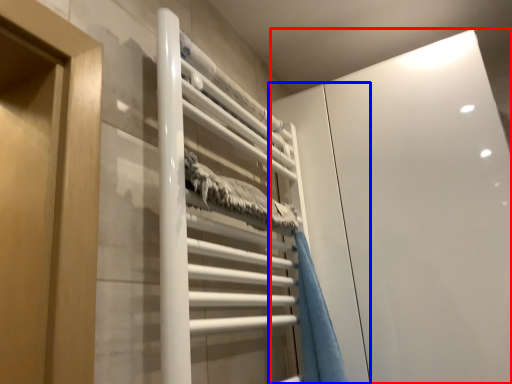
Question: Which point is further to the camera, glass door (highlighted by a red box) or screen door (highlighted by a blue box)?

Choices:
 (A) glass door
 (B) screen door

Answer: (A)